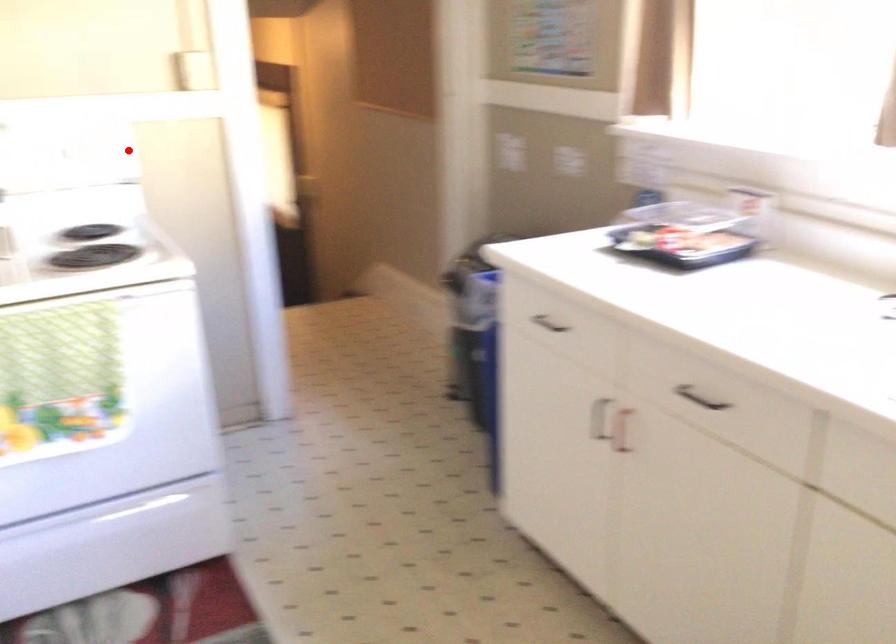
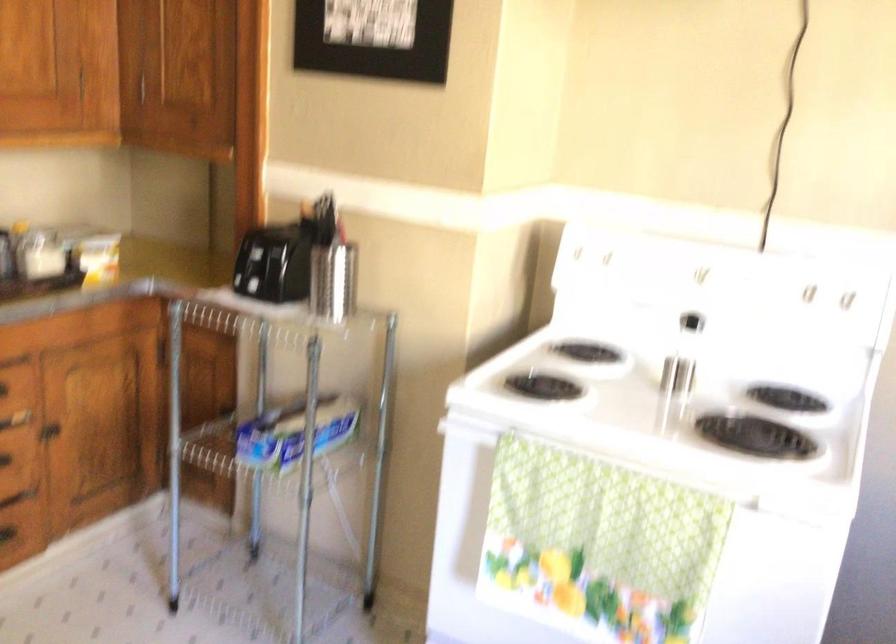
The point at the highlighted location is marked in the first image. Where is the corresponding point in the second image?

(845, 299)